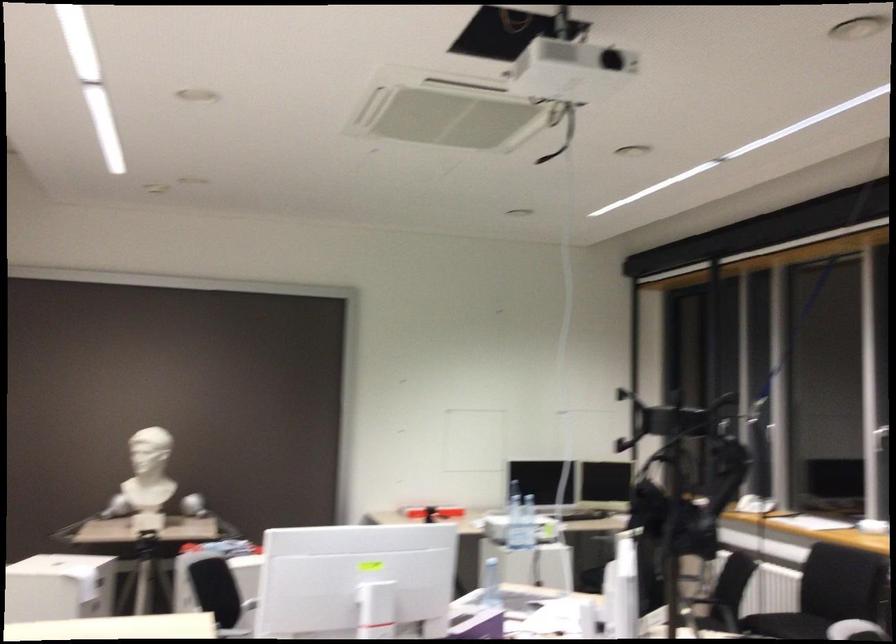
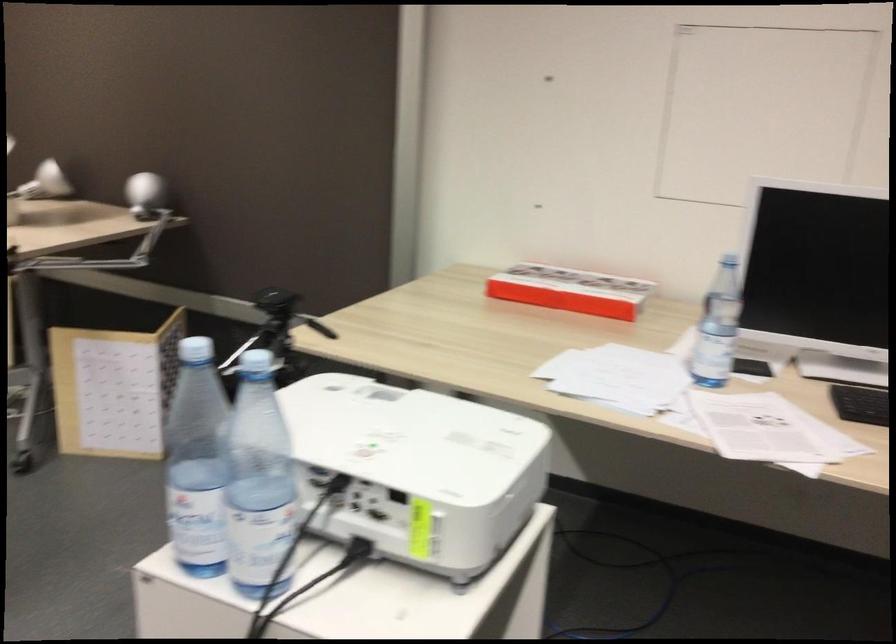
Where in the second image is the point corresponding to (217,484) from the first image?

(143, 194)